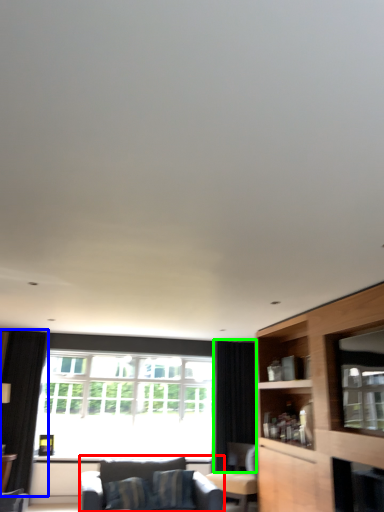
Question: Which object is the farthest from studio couch (highlighted by a red box)? Choose among these: curtain (highlighted by a blue box) or curtain (highlighted by a green box).

Choices:
 (A) curtain
 (B) curtain

Answer: (A)